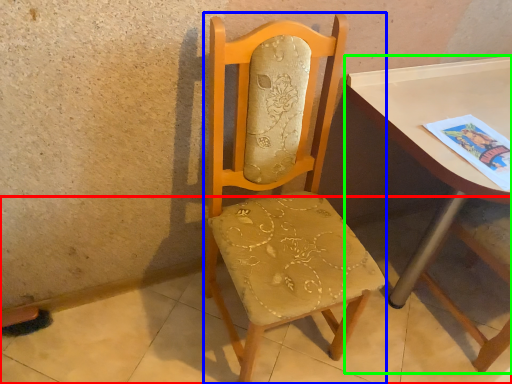
Question: Estimate the real-world distances between objects in this image. Which object is closer to concrete (highlighted by a red box), chair (highlighted by a blue box) or table (highlighted by a green box)?

Choices:
 (A) chair
 (B) table

Answer: (A)